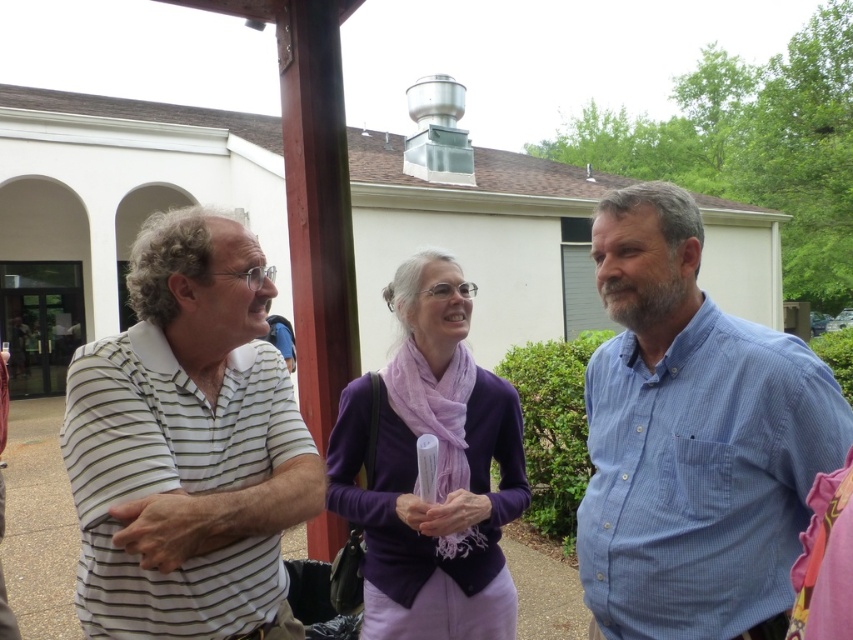
Question: Which of the following is the closest to the observer?

Choices:
 (A) (161, 531)
 (B) (782, 474)
 (C) (737, 412)

Answer: (A)

Question: Does blue striped shirt at right come behind purple matte sweater at center?

Choices:
 (A) no
 (B) yes

Answer: (A)

Question: Which point is farther to the camera?

Choices:
 (A) purple matte sweater at center
 (B) white striped polo shirt at left
 (C) white striped shirt at left
 (D) blue striped shirt at right

Answer: (A)

Question: Is white striped shirt at left bigger than blue striped shirt at right?

Choices:
 (A) yes
 (B) no

Answer: (A)

Question: Can you confirm if white striped polo shirt at left is positioned to the right of purple matte sweater at center?

Choices:
 (A) yes
 (B) no

Answer: (B)

Question: Which point is farther to the camera?

Choices:
 (A) white striped shirt at left
 (B) blue striped shirt at right

Answer: (B)